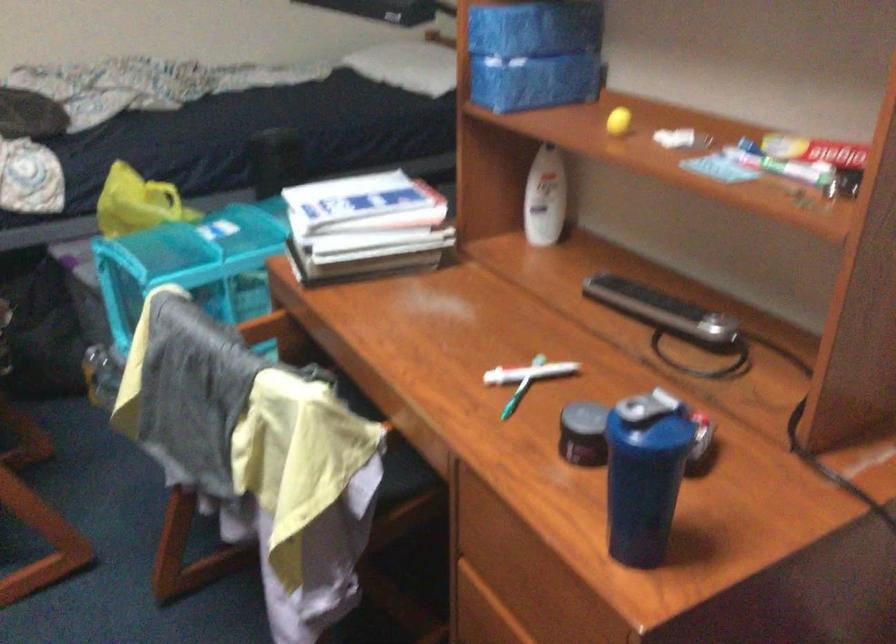
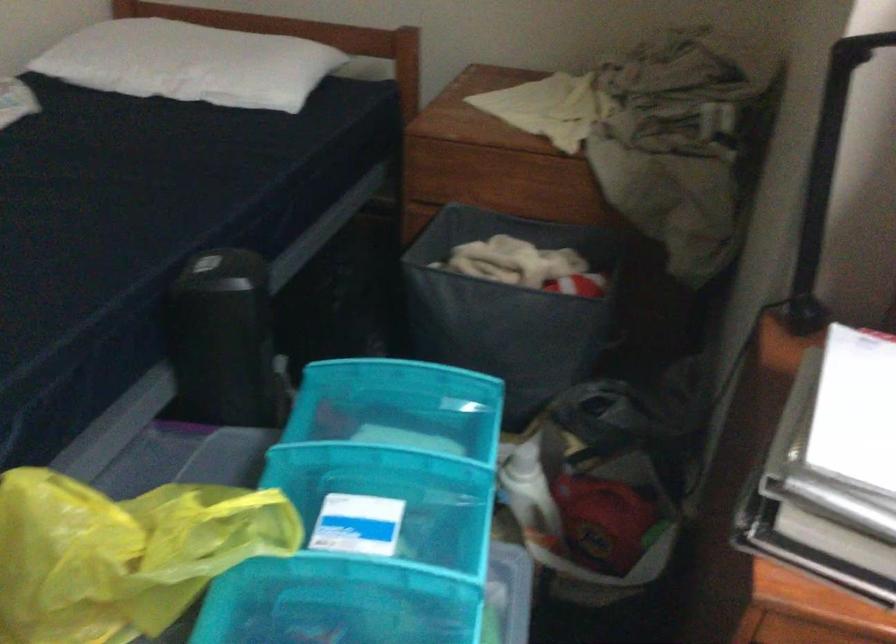
Find the pixel in the second image that matches (126,196) in the first image.

(122, 554)